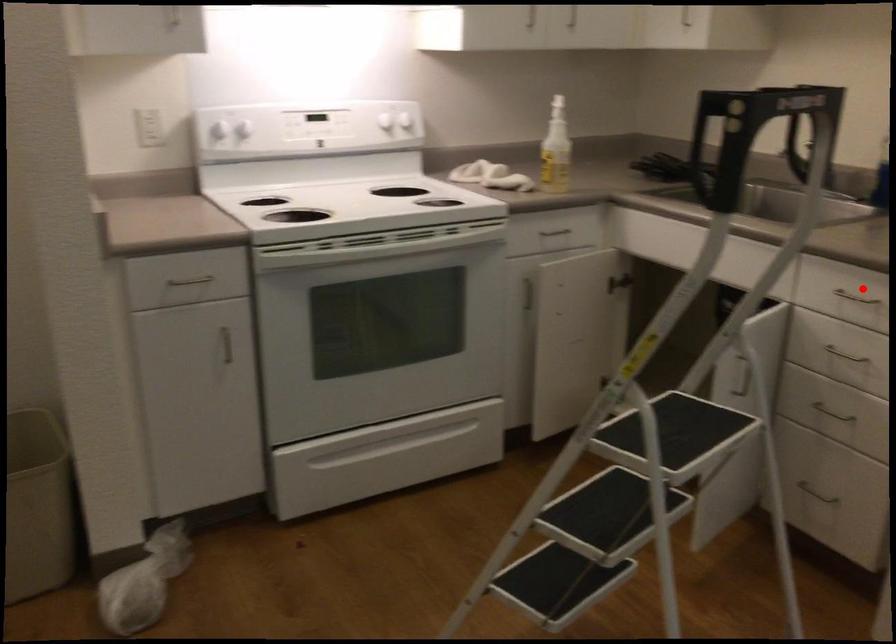
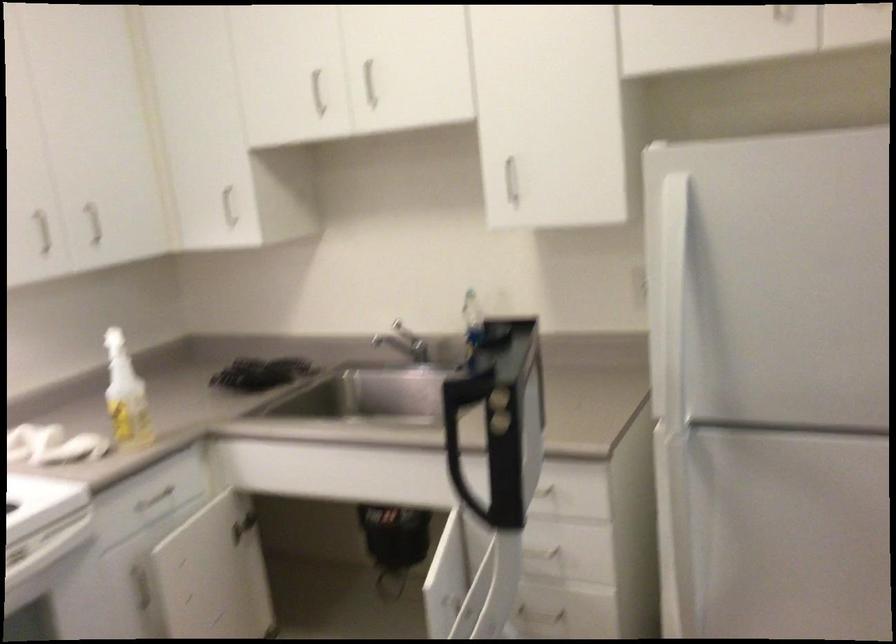
Question: I am providing you with two images of the same scene from different viewpoints. A red point is marked on the first image. At the location where the point appears in image 1, is it still visible in image 2?

Choices:
 (A) Yes
 (B) No

Answer: (B)